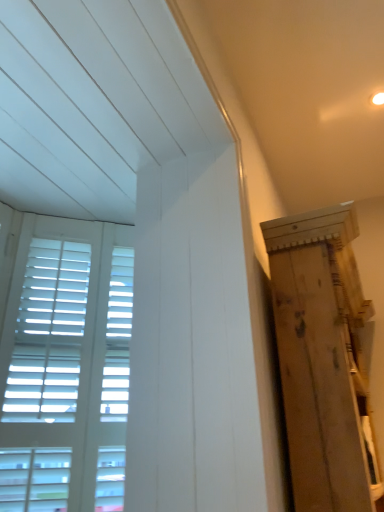
Question: Looking at the image, does white wooden shutters at left seem bigger or smaller compared to natural wood plywood at right?

Choices:
 (A) big
 (B) small

Answer: (B)

Question: Is white wooden shutters at left in front of or behind natural wood plywood at right in the image?

Choices:
 (A) front
 (B) behind

Answer: (B)

Question: Based on their positions, is white wooden shutters at left located to the left or right of natural wood plywood at right?

Choices:
 (A) right
 (B) left

Answer: (B)

Question: Would you say natural wood plywood at right is inside or outside white wooden shutters at left?

Choices:
 (A) outside
 (B) inside

Answer: (A)

Question: From the image's perspective, relative to white wooden shutters at left, is natural wood plywood at right above or below?

Choices:
 (A) below
 (B) above

Answer: (A)

Question: From a real-world perspective, is natural wood plywood at right positioned above or below white wooden shutters at left?

Choices:
 (A) above
 (B) below

Answer: (B)

Question: Considering the positions of point (354, 287) and point (127, 236), is point (354, 287) closer or farther from the camera than point (127, 236)?

Choices:
 (A) farther
 (B) closer

Answer: (B)